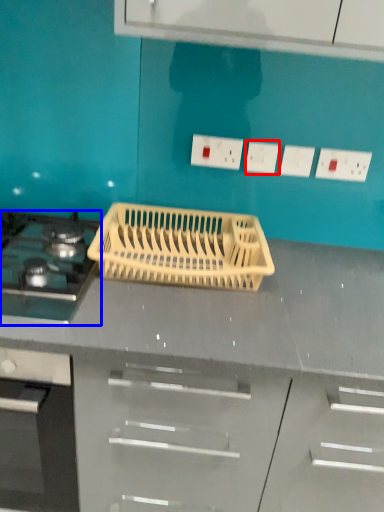
Question: Which point is closer to the camera, electric outlet (highlighted by a red box) or gas stove (highlighted by a blue box)?

Choices:
 (A) electric outlet
 (B) gas stove

Answer: (B)